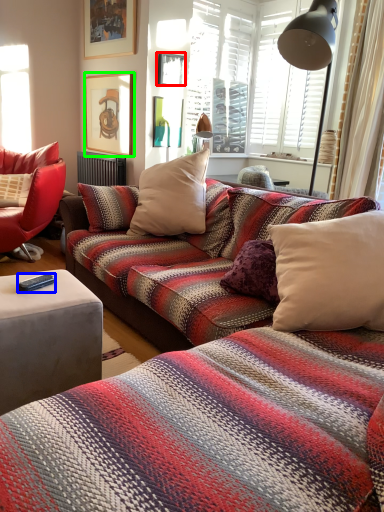
Question: Based on their relative distances, which object is farther from picture frame (highlighted by a red box)? Choose from remote control (highlighted by a blue box) and picture frame (highlighted by a green box).

Choices:
 (A) remote control
 (B) picture frame

Answer: (A)